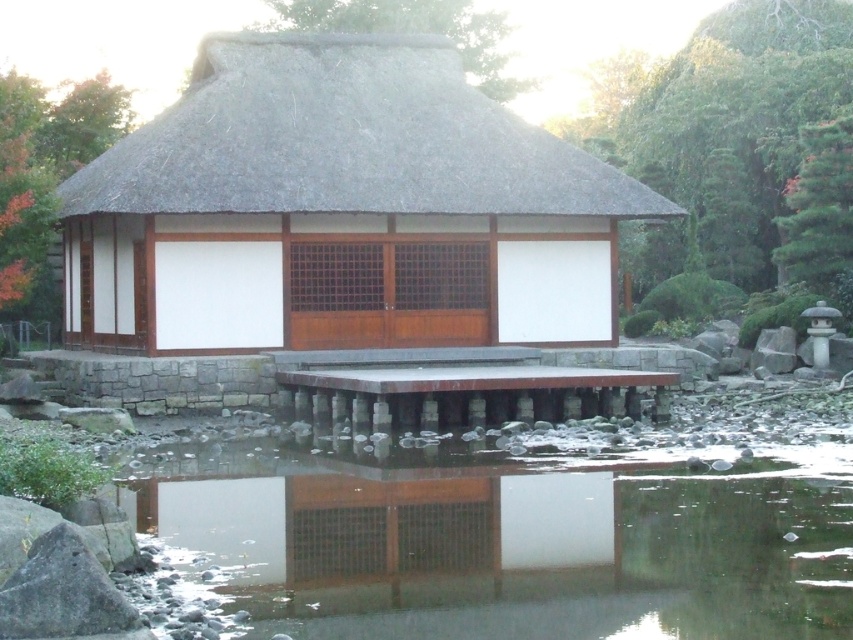
Question: Which object appears closest to the camera in this image?

Choices:
 (A) transparent glass water at lower center
 (B) thatched roof at center

Answer: (A)

Question: Is transparent glass water at lower center positioned at the back of thatched roof at center?

Choices:
 (A) yes
 (B) no

Answer: (B)

Question: Does transparent glass water at lower center appear on the right side of thatched roof at center?

Choices:
 (A) no
 (B) yes

Answer: (B)

Question: Among these objects, which one is farthest from the camera?

Choices:
 (A) transparent glass water at lower center
 (B) thatched roof at center

Answer: (B)

Question: Is the position of transparent glass water at lower center more distant than that of thatched roof at center?

Choices:
 (A) yes
 (B) no

Answer: (B)

Question: Which object is closer to the camera taking this photo?

Choices:
 (A) transparent glass water at lower center
 (B) thatched roof at center

Answer: (A)